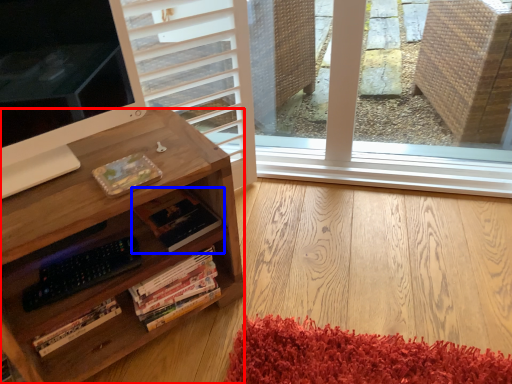
Question: Which object is closer to the camera taking this photo, desk (highlighted by a red box) or book (highlighted by a blue box)?

Choices:
 (A) desk
 (B) book

Answer: (A)